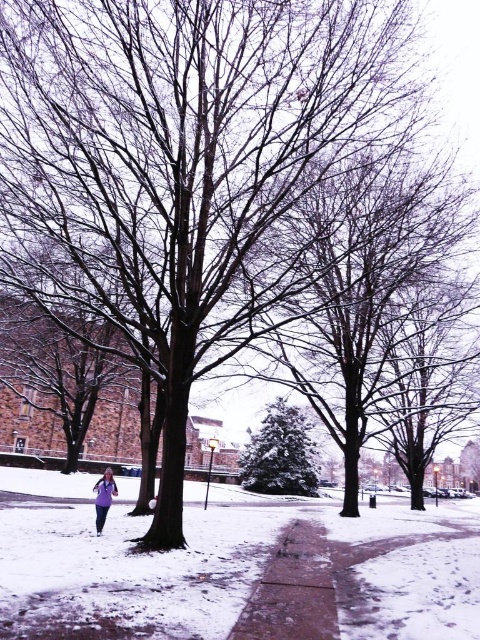
Does green textured evergreen tree at center have a smaller size compared to purple matte jacket at lower left?

Yes, green textured evergreen tree at center is smaller than purple matte jacket at lower left.

Is green textured evergreen tree at center bigger than purple matte jacket at lower left?

No, green textured evergreen tree at center is not bigger than purple matte jacket at lower left.

Looking at this image, who is more distant from viewer, (300,477) or (108,496)?

Positioned behind is point (300,477).

Where is `green textured evergreen tree at center`? green textured evergreen tree at center is located at coordinates (280, 452).

Is sandy concrete sidewalk at center wider than purple matte jacket at lower left?

Indeed, sandy concrete sidewalk at center has a greater width compared to purple matte jacket at lower left.

Does sandy concrete sidewalk at center have a smaller size compared to purple matte jacket at lower left?

Actually, sandy concrete sidewalk at center might be larger than purple matte jacket at lower left.

Does point (19, 564) lie behind point (97, 525)?

No.

Identify the location of sandy concrete sidewalk at center. (233, 566).

Can you confirm if sandy concrete sidewalk at center is thinner than green textured evergreen tree at center?

Incorrect, sandy concrete sidewalk at center's width is not less than green textured evergreen tree at center's.

Can you confirm if sandy concrete sidewalk at center is taller than green textured evergreen tree at center?

Yes.

Is point (282, 516) farther from camera compared to point (272, 413)?

No, (282, 516) is closer to viewer.

Image resolution: width=480 pixels, height=640 pixels. I want to click on sandy concrete sidewalk at center, so click(233, 566).